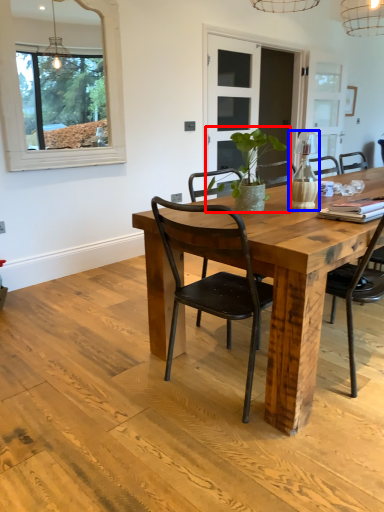
Question: Which object appears closest to the camera in this image, houseplant (highlighted by a red box) or vase (highlighted by a blue box)?

Choices:
 (A) houseplant
 (B) vase

Answer: (A)